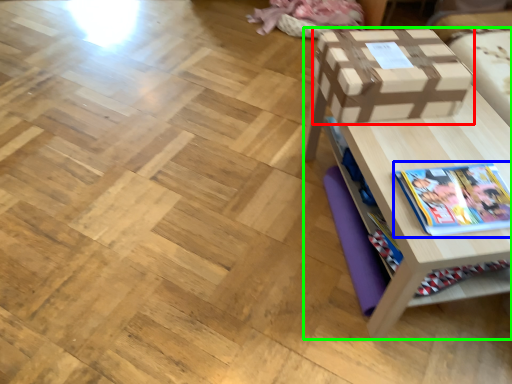
Question: Estimate the real-world distances between objects in this image. Which object is closer to box (highlighted by a red box), book (highlighted by a blue box) or table (highlighted by a green box)?

Choices:
 (A) book
 (B) table

Answer: (B)